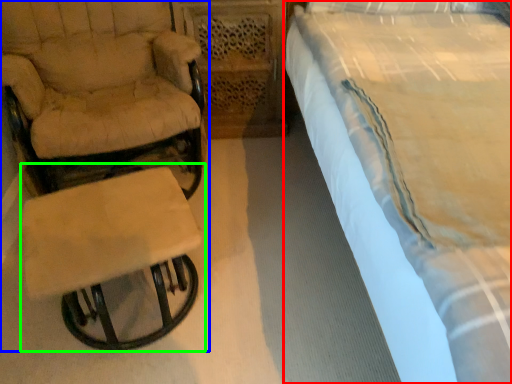
Question: Considering the real-world distances, which object is farthest from bed (highlighted by a red box)? chair (highlighted by a blue box) or table (highlighted by a green box)?

Choices:
 (A) chair
 (B) table

Answer: (A)